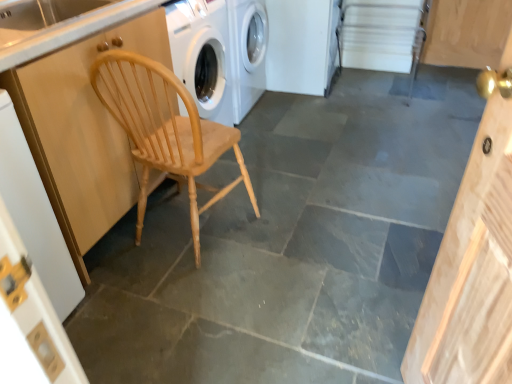
Question: Is the position of white glossy counter top at upper left less distant than that of wooden door at left?

Choices:
 (A) yes
 (B) no

Answer: (B)

Question: Can you confirm if white glossy counter top at upper left is thinner than wooden door at left?

Choices:
 (A) no
 (B) yes

Answer: (A)

Question: From the image's perspective, is white glossy counter top at upper left located beneath wooden door at left?

Choices:
 (A) no
 (B) yes

Answer: (A)

Question: Is white glossy counter top at upper left wider than wooden door at left?

Choices:
 (A) yes
 (B) no

Answer: (A)

Question: Is white glossy counter top at upper left shorter than wooden door at left?

Choices:
 (A) no
 (B) yes

Answer: (B)

Question: Is point (53, 36) closer or farther from the camera than point (56, 109)?

Choices:
 (A) farther
 (B) closer

Answer: (B)

Question: From a real-world perspective, is white glossy counter top at upper left positioned above or below natural wood cabinet at left?

Choices:
 (A) below
 (B) above

Answer: (B)

Question: Looking at their shapes, would you say white glossy counter top at upper left is wider or thinner than natural wood cabinet at left?

Choices:
 (A) wide
 (B) thin

Answer: (B)

Question: From the image's perspective, is white glossy counter top at upper left positioned above or below natural wood cabinet at left?

Choices:
 (A) below
 (B) above

Answer: (B)

Question: In the image, is natural wood chair at left on the left side or the right side of wooden door at left?

Choices:
 (A) right
 (B) left

Answer: (A)

Question: Relative to wooden door at left, is natural wood chair at left in front or behind?

Choices:
 (A) behind
 (B) front

Answer: (A)

Question: From their relative heights in the image, would you say natural wood chair at left is taller or shorter than wooden door at left?

Choices:
 (A) short
 (B) tall

Answer: (A)

Question: In terms of width, does natural wood chair at left look wider or thinner when compared to wooden door at left?

Choices:
 (A) wide
 (B) thin

Answer: (A)

Question: Is natural wood cabinet at left inside the boundaries of natural wood chair at left, or outside?

Choices:
 (A) inside
 (B) outside

Answer: (B)

Question: From a real-world perspective, relative to natural wood chair at left, is natural wood cabinet at left vertically above or below?

Choices:
 (A) above
 (B) below

Answer: (A)